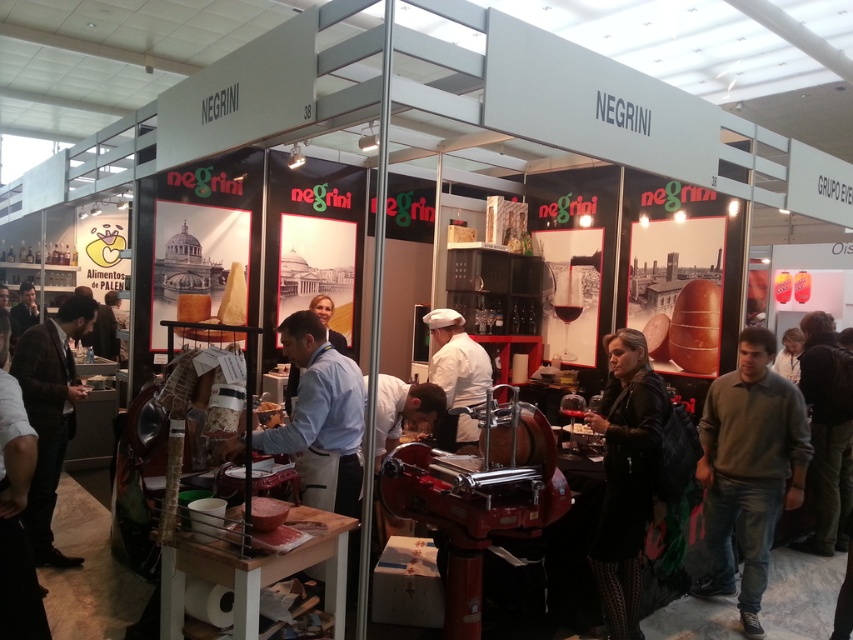
You are a customer in the Negrini booth and you want to ask about their cheese selection. Which item of clothing should you approach first, the gray sweater at right or the black leather jacket at center?

The gray sweater at right is positioned on the right side of the black leather jacket at center, so you should approach the black leather jacket at center first as it is closer to the center of the booth and likely closer to you.